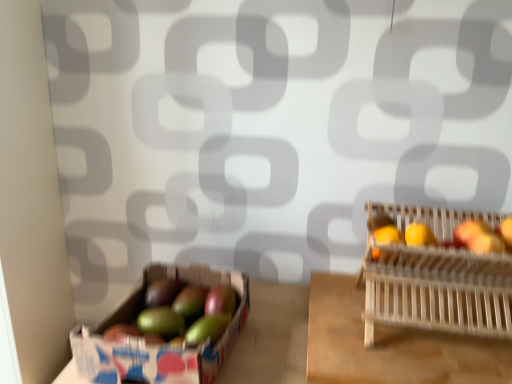
I want to click on unoccupied region to the right of green matte apple at center, which is the 3th apple from right to left, so click(x=274, y=324).